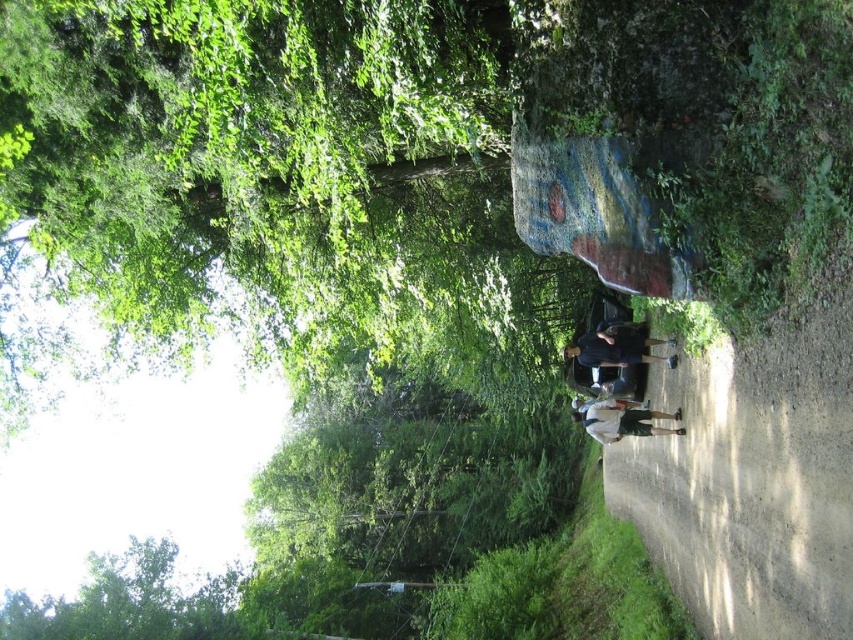
Question: Can you confirm if black matte shirt at center is positioned below white cotton shirt at center?

Choices:
 (A) yes
 (B) no

Answer: (B)

Question: Among these objects, which one is farthest from the camera?

Choices:
 (A) white cotton shirt at center
 (B) black matte shirt at center

Answer: (B)

Question: Is black matte shirt at center above white cotton shirt at center?

Choices:
 (A) yes
 (B) no

Answer: (A)

Question: Which of the following is the farthest from the observer?

Choices:
 (A) (596, 346)
 (B) (599, 432)

Answer: (A)

Question: From the image, what is the correct spatial relationship of black matte shirt at center in relation to white cotton shirt at center?

Choices:
 (A) below
 (B) above

Answer: (B)